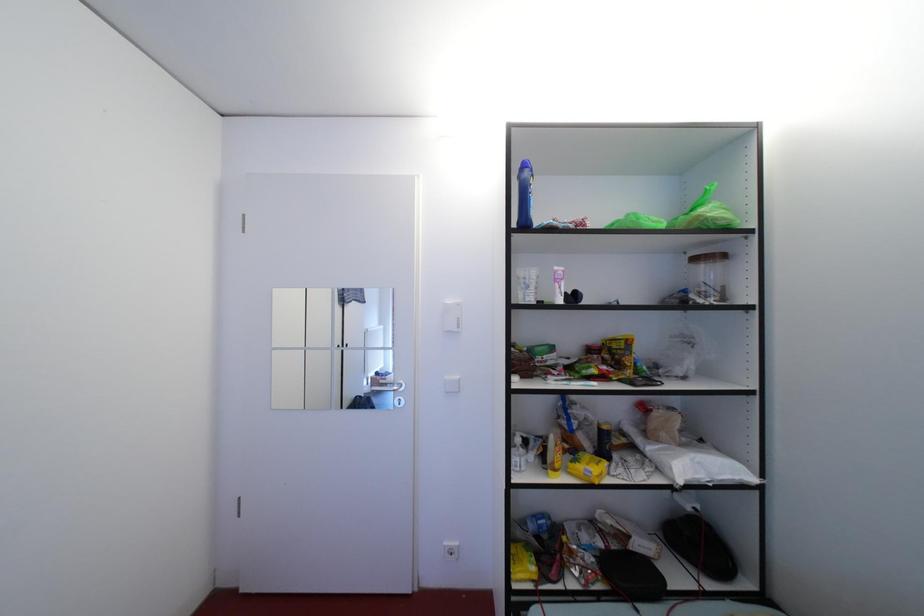
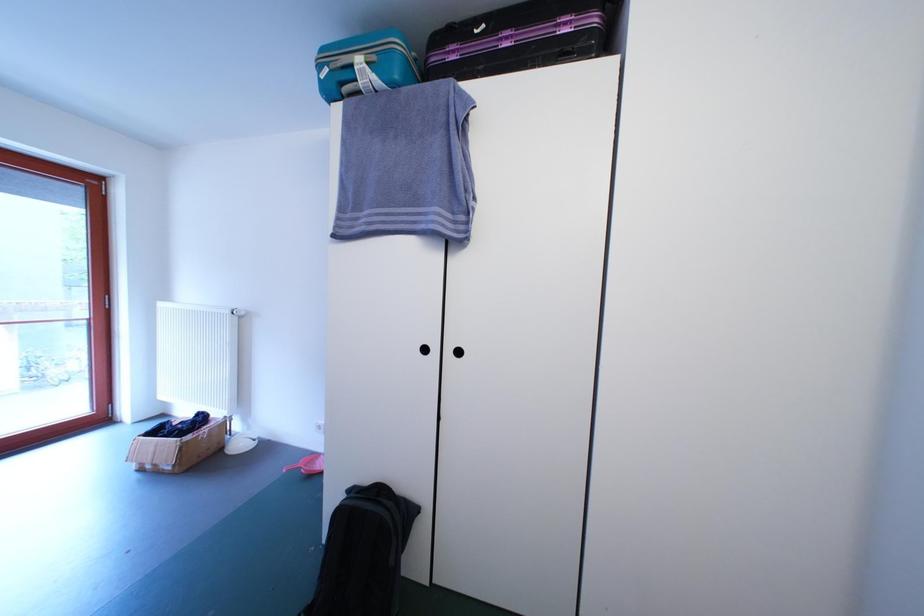
Question: How did the camera likely rotate?

Choices:
 (A) Left
 (B) Right
 (C) Up
 (D) Down

Answer: (A)